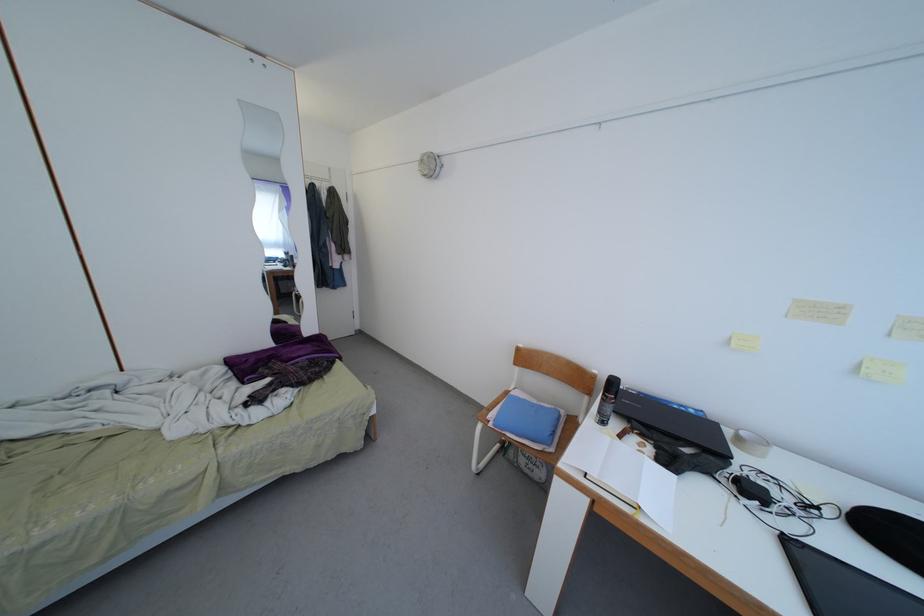
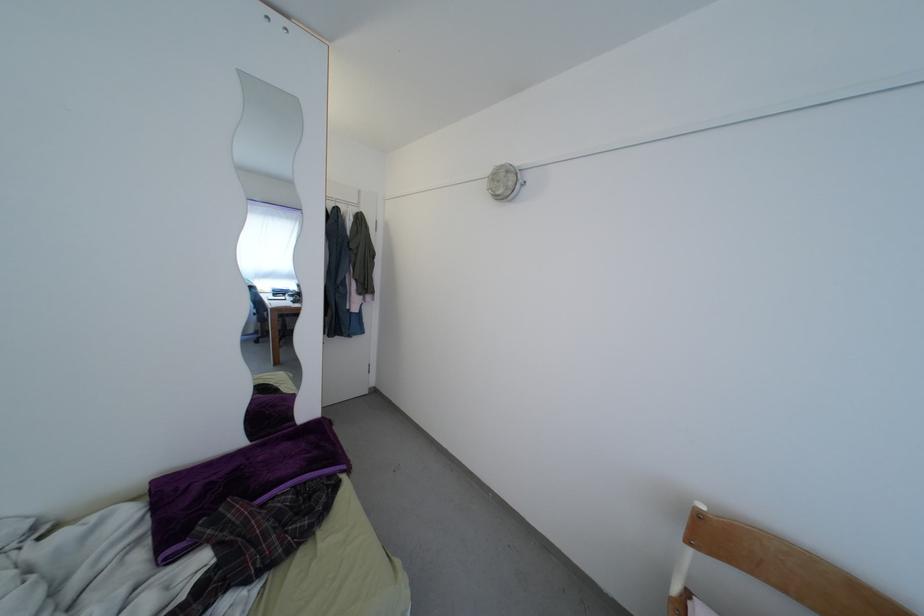
Find the pixel in the second image that matches the point at 520,370 in the first image.

(694, 548)